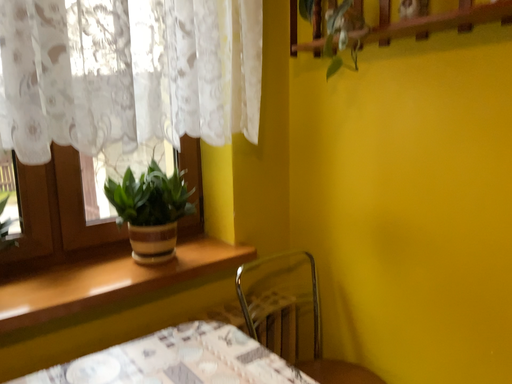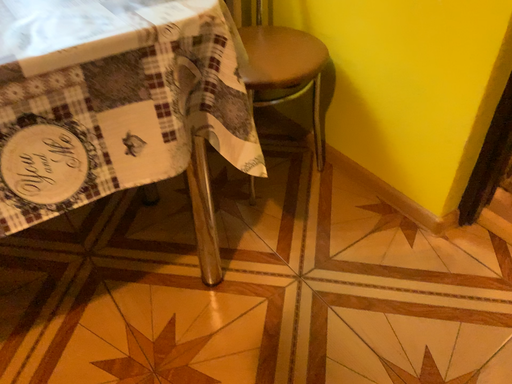
Question: How did the camera likely rotate when shooting the video?

Choices:
 (A) rotated downward
 (B) rotated upward

Answer: (A)